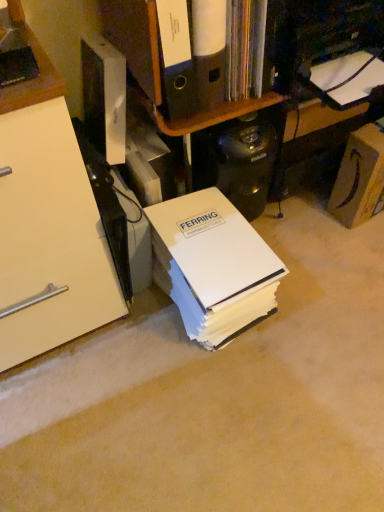
The height and width of the screenshot is (512, 384). Describe the element at coordinates (315, 131) in the screenshot. I see `matte black coffee maker at upper right` at that location.

This screenshot has width=384, height=512. What do you see at coordinates (360, 177) in the screenshot?
I see `matte brown cardboard box at right` at bounding box center [360, 177].

Describe the element at coordinates (193, 57) in the screenshot. The width and height of the screenshot is (384, 512). I see `white cardboard shelf at upper center` at that location.

Describe the element at coordinates (212, 265) in the screenshot. I see `white paper at center` at that location.

Locate an element on the screen. black plastic computer tower at center is located at coordinates tap(243, 161).

Is point (137, 21) closer to camera compared to point (233, 190)?

Yes, point (137, 21) is closer to viewer.

Is white cardboard shelf at upper center to the left of black plastic computer tower at center from the viewer's perspective?

Correct, you'll find white cardboard shelf at upper center to the left of black plastic computer tower at center.

Is white cardboard shelf at upper center not close to black plastic computer tower at center?

No, white cardboard shelf at upper center is in close proximity to black plastic computer tower at center.

Is black plastic computer tower at center next to matte black coffee maker at upper right and touching it?

No, black plastic computer tower at center is not making contact with matte black coffee maker at upper right.

Is point (220, 170) farther from viewer compared to point (279, 191)?

No, (220, 170) is closer to viewer.

Is black plastic computer tower at center oriented away from matte black coffee maker at upper right?

black plastic computer tower at center is not turned away from matte black coffee maker at upper right.

From a real-world perspective, which object stands above the other?

In real-world perspective, white cardboard shelf at upper center is above.

Does white paper at center have a greater width compared to white cardboard shelf at upper center?

Correct, the width of white paper at center exceeds that of white cardboard shelf at upper center.

Considering the sizes of objects white paper at center and white cardboard shelf at upper center in the image provided, who is taller, white paper at center or white cardboard shelf at upper center?

A: white paper at center is taller.

Which object is more forward, matte black coffee maker at upper right or white cardboard shelf at upper center?

white cardboard shelf at upper center is closer to the camera.

Based on the photo, from a real-world perspective, is matte black coffee maker at upper right physically located above or below white cardboard shelf at upper center?

matte black coffee maker at upper right is situated lower than white cardboard shelf at upper center in the real world.

Is matte black coffee maker at upper right to the left or to the right of white cardboard shelf at upper center in the image?

matte black coffee maker at upper right is to the right of white cardboard shelf at upper center.

Is black plastic computer tower at center wider than white cardboard shelf at upper center?

Incorrect, the width of black plastic computer tower at center does not surpass that of white cardboard shelf at upper center.

Is black plastic computer tower at center completely or partially outside of white cardboard shelf at upper center?

Yes.

From a real-world perspective, relative to white cardboard shelf at upper center, is black plastic computer tower at center vertically above or below?

black plastic computer tower at center is situated lower than white cardboard shelf at upper center in the real world.

Does black plastic computer tower at center appear on the right side of white cardboard shelf at upper center?

Yes, black plastic computer tower at center is to the right of white cardboard shelf at upper center.

In terms of height, does white cardboard shelf at upper center look taller or shorter compared to white paper at center?

In the image, white cardboard shelf at upper center appears to be shorter than white paper at center.

Which of these two, white cardboard shelf at upper center or white paper at center, is bigger?

Bigger between the two is white paper at center.

Choose the correct answer: Is white cardboard shelf at upper center inside white paper at center or outside it?

white cardboard shelf at upper center is not inside white paper at center, it's outside.

Which is nearer, (225, 153) or (268, 308)?

Point (225, 153) is closer to the camera than point (268, 308).

Is black plastic computer tower at center to the left of white paper at center from the viewer's perspective?

Incorrect, black plastic computer tower at center is not on the left side of white paper at center.

Considering the relative sizes of black plastic computer tower at center and white paper at center in the image provided, is black plastic computer tower at center shorter than white paper at center?

Incorrect, the height of black plastic computer tower at center does not fall short of that of white paper at center.

Can you confirm if black plastic computer tower at center is smaller than white paper at center?

Yes, black plastic computer tower at center is smaller than white paper at center.

Where is `computer tower that is behind the white cardboard shelf at upper center`? The width and height of the screenshot is (384, 512). computer tower that is behind the white cardboard shelf at upper center is located at coordinates (243, 161).

There is a matte black coffee maker at upper right. Where is `computer tower above it (from a real-world perspective)`? The image size is (384, 512). computer tower above it (from a real-world perspective) is located at coordinates (243, 161).

Based on their spatial positions, is white paper at center or matte black coffee maker at upper right closer to black plastic computer tower at center?

Based on the image, matte black coffee maker at upper right appears to be nearer to black plastic computer tower at center.

When comparing their distances from matte black coffee maker at upper right, does black plastic computer tower at center or matte brown cardboard box at right seem closer?

The object closer to matte black coffee maker at upper right is matte brown cardboard box at right.

Based on their spatial positions, is black plastic computer tower at center or matte black coffee maker at upper right further from matte brown cardboard box at right?

Among the two, black plastic computer tower at center is located further to matte brown cardboard box at right.

Estimate the real-world distances between objects in this image. Which object is further from matte black coffee maker at upper right, black plastic computer tower at center or white paper at center?

Among the two, white paper at center is located further to matte black coffee maker at upper right.

Considering their positions, is black plastic computer tower at center positioned closer to white cardboard shelf at upper center than matte brown cardboard box at right?

black plastic computer tower at center lies closer to white cardboard shelf at upper center than the other object.

Which object lies nearer to the anchor point white paper at center, white cardboard shelf at upper center or matte brown cardboard box at right?

Based on the image, white cardboard shelf at upper center appears to be nearer to white paper at center.

When comparing their distances from matte black coffee maker at upper right, does white paper at center or black plastic computer tower at center seem further?

white paper at center is positioned further to the anchor matte black coffee maker at upper right.

Considering their positions, is black plastic computer tower at center positioned closer to white paper at center than matte brown cardboard box at right?

black plastic computer tower at center lies closer to white paper at center than the other object.

Where is `computer tower between white cardboard shelf at upper center and matte black coffee maker at upper right from left to right`? Image resolution: width=384 pixels, height=512 pixels. computer tower between white cardboard shelf at upper center and matte black coffee maker at upper right from left to right is located at coordinates (243, 161).

Find the location of a particular element. computer desk between white cardboard shelf at upper center and white paper at center in the up-down direction is located at coordinates (315, 131).

Locate an element on the screen. computer tower that lies between matte black coffee maker at upper right and white paper at center from top to bottom is located at coordinates (243, 161).

Where is `computer desk between black plastic computer tower at center and matte brown cardboard box at right`? computer desk between black plastic computer tower at center and matte brown cardboard box at right is located at coordinates (315, 131).